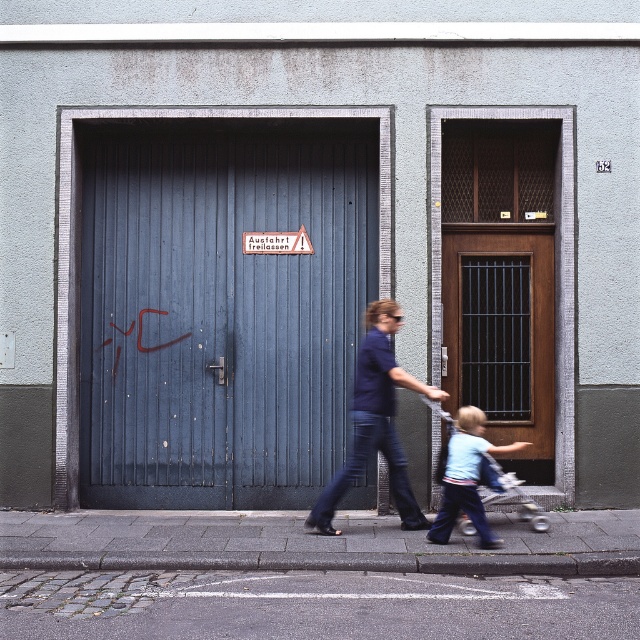
You are a delivery person trying to enter the building and need to choose between the blue wooden garage door at left and the wooden door with metal bars at right. Which door is wider and more suitable for carrying a large package?

The blue wooden garage door at left is wider than the wooden door with metal bars at right, so it is more suitable for carrying a large package.

You are standing on the cobblestone pavement at lower left and want to move to the light blue denim pants at lower center. Can you step directly onto the pants without stepping on anything else?

The cobblestone pavement at lower left is wider than the light blue denim pants at lower center, so stepping directly onto the pants might be challenging as the pavement is wider. You might step on the pavement first before reaching the pants.

You are a delivery person trying to park your van on the cobblestone pavement at lower left. The van requires a space larger than the area occupied by the wooden door with metal bars at right. Can you park your van there?

The cobblestone pavement at lower left occupies less space than the wooden door with metal bars at right, so the van cannot park there because the required space is larger than what is available.